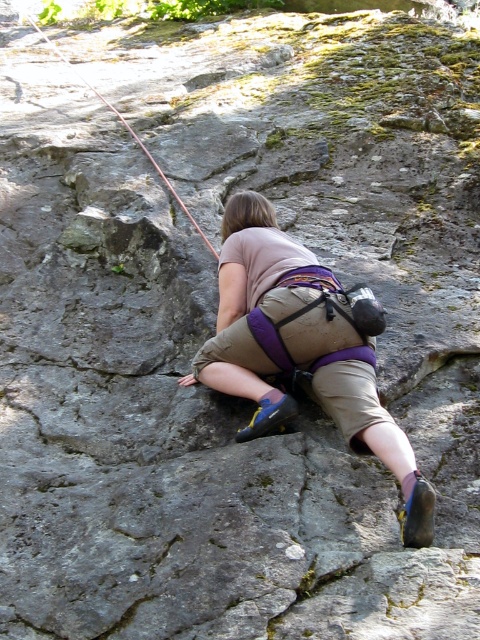
The climber is wearing khaki cotton shorts at center. If you were to mark their exact position on the rock face, what are the coordinates?

The khaki cotton shorts at center are located at coordinates point [302,346].

You are a photographer standing at the base of the rock face. You want to take a photo that includes both the khaki cotton shorts at center and the red nylon rope at upper center. Which object will appear larger in the photo?

The khaki cotton shorts at center will appear larger in the photo because it is closer to the viewer than the red nylon rope at upper center.